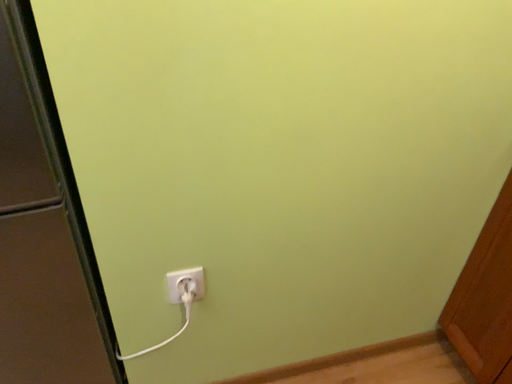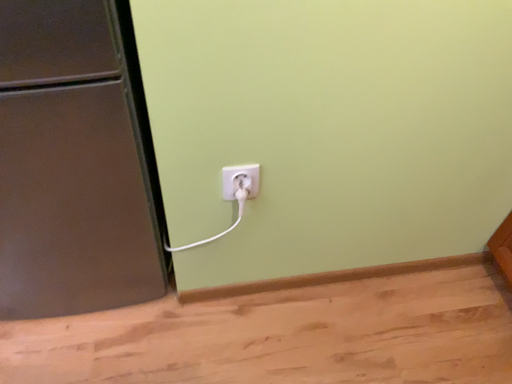
Question: Which way did the camera rotate in the video?

Choices:
 (A) rotated downward
 (B) rotated upward

Answer: (A)